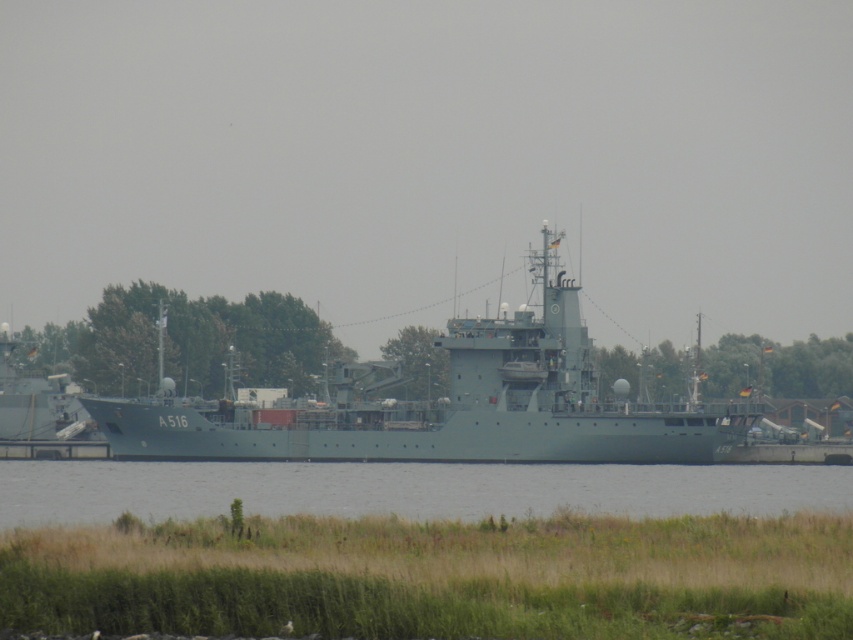
Question: Estimate the real-world distances between objects in this image. Which object is farther from the green matte ship at left?

Choices:
 (A) gray water at lower center
 (B) matte gray ship at center

Answer: (A)

Question: Can you confirm if matte gray ship at center is smaller than gray water at lower center?

Choices:
 (A) yes
 (B) no

Answer: (B)

Question: Estimate the real-world distances between objects in this image. Which object is closer to the gray water at lower center?

Choices:
 (A) green matte ship at left
 (B) matte gray ship at center

Answer: (B)

Question: Does matte gray ship at center have a lesser width compared to gray water at lower center?

Choices:
 (A) yes
 (B) no

Answer: (A)

Question: Considering the relative positions of gray water at lower center and green matte ship at left in the image provided, where is gray water at lower center located with respect to green matte ship at left?

Choices:
 (A) above
 (B) below

Answer: (B)

Question: Which point is closer to the camera taking this photo?

Choices:
 (A) (55, 406)
 (B) (26, 506)

Answer: (B)